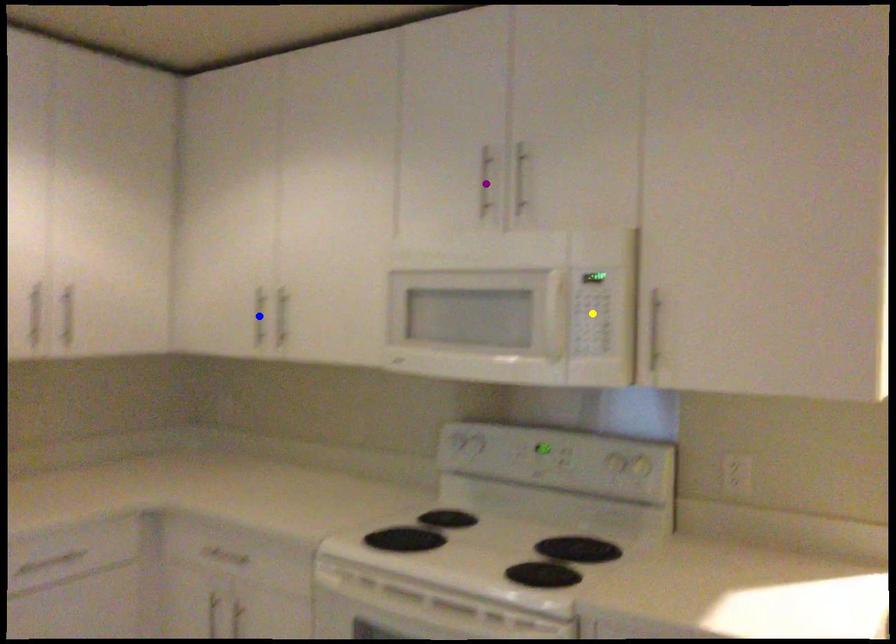
Order these from nearest to farthest:
yellow point
blue point
purple point

yellow point
purple point
blue point